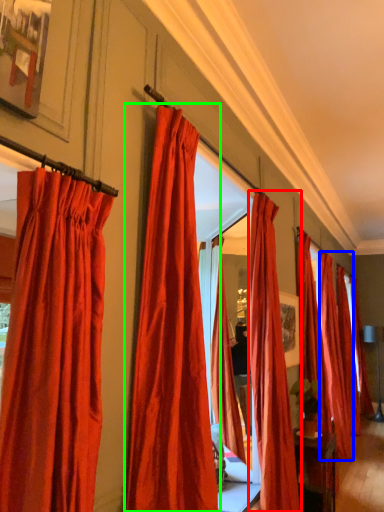
Question: Which is nearer to the curtain (highlighted by a red box)? curtain (highlighted by a blue box) or curtain (highlighted by a green box).

Choices:
 (A) curtain
 (B) curtain

Answer: (B)